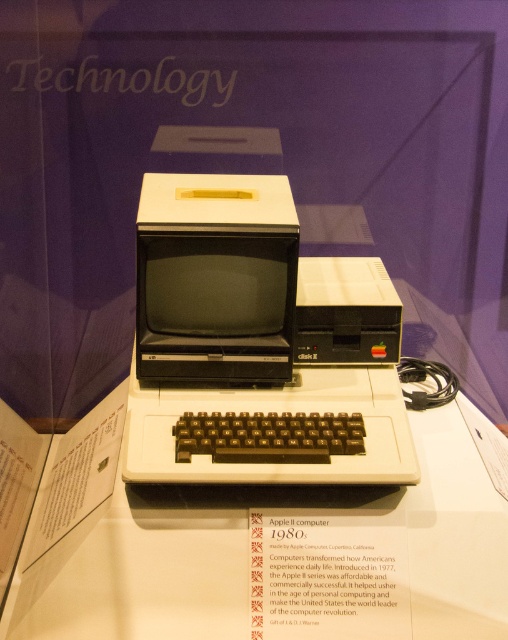
You are a museum visitor standing in front of the vintage Apple II computer exhibit. You see the white plastic table at center and the matte black monitor at center. Which object is located above the other?

The matte black monitor at center is above the white plastic table at center because the white plastic table at center is positioned under it.

You are a visitor standing in front of the vintage Apple II computer exhibit. You want to take a clear photo of the matte black monitor at center with your smartphone camera. Considering the distance between you and the monitor, will you be able to capture the entire monitor in your photo without moving closer or farther away?

The matte black monitor at center and camera are 4.14 feet apart from each other. Since smartphones typically have a minimum focusing distance of about 8 inches to 2 feet, 4.14 feet is well within the focusing range. Therefore, you can capture the entire matte black monitor at center in your photo without needing to adjust your distance.

From the picture: You are a museum visitor holding a small 3.5 inch floppy disk. You want to place it on the white plastic table at center but need to ensure there is enough space between it and the black plastic keyboard at center. Can you fit the disk without it overlapping the keyboard?

The white plastic table at center and black plastic keyboard at center are 6.99 inches apart. Since the floppy disk is 3.5 inches wide, there is sufficient space between them to place the disk without overlapping the keyboard.